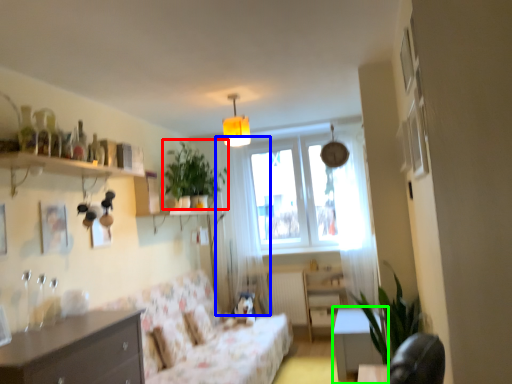
Question: Considering the real-world distances, which object is closest to plant (highlighted by a red box)? curtain (highlighted by a blue box) or table (highlighted by a green box).

Choices:
 (A) curtain
 (B) table

Answer: (A)